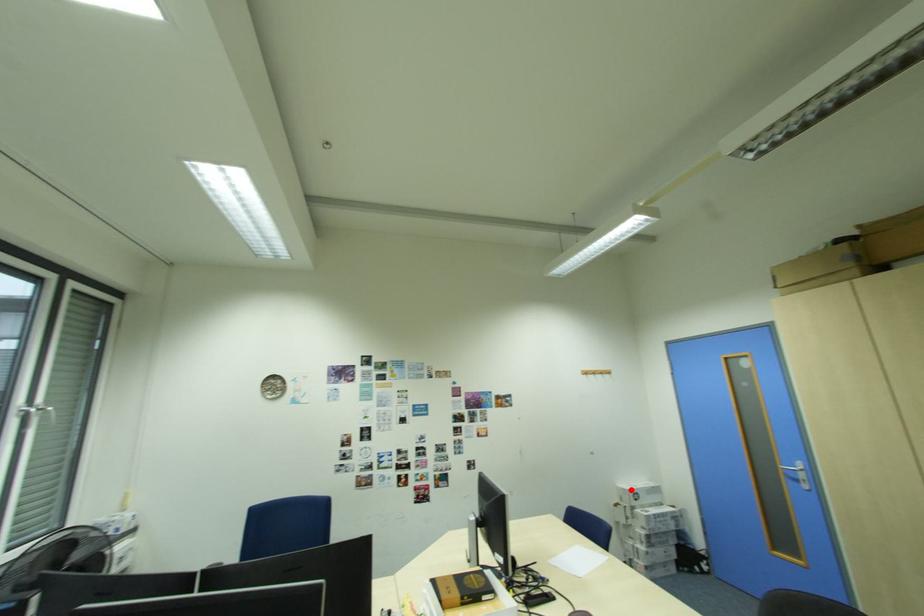
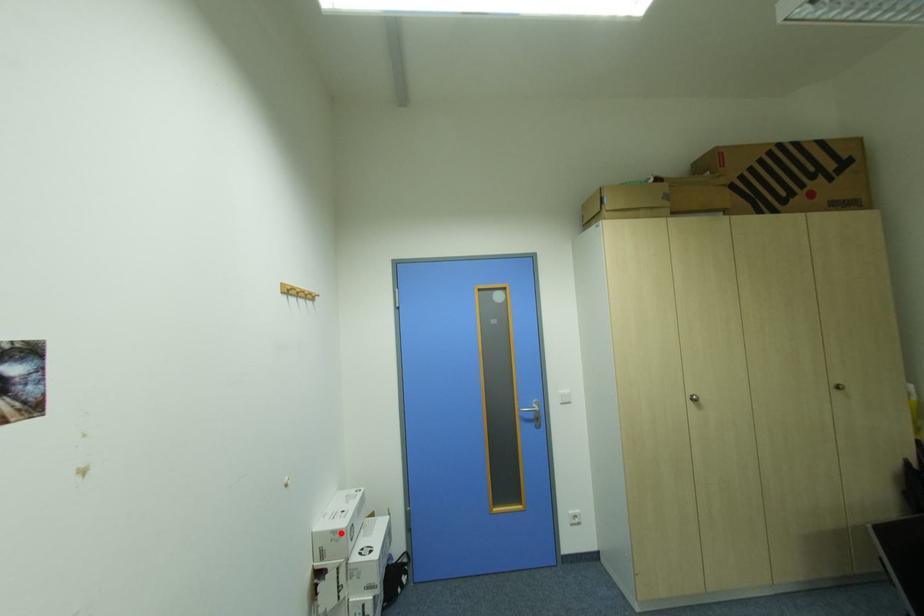
I am providing you with two images of the same scene from different viewpoints. A red point is marked on the first image and another point is marked on the second image. Is the red point in image1 aligned with the point shown in image2?

Yes